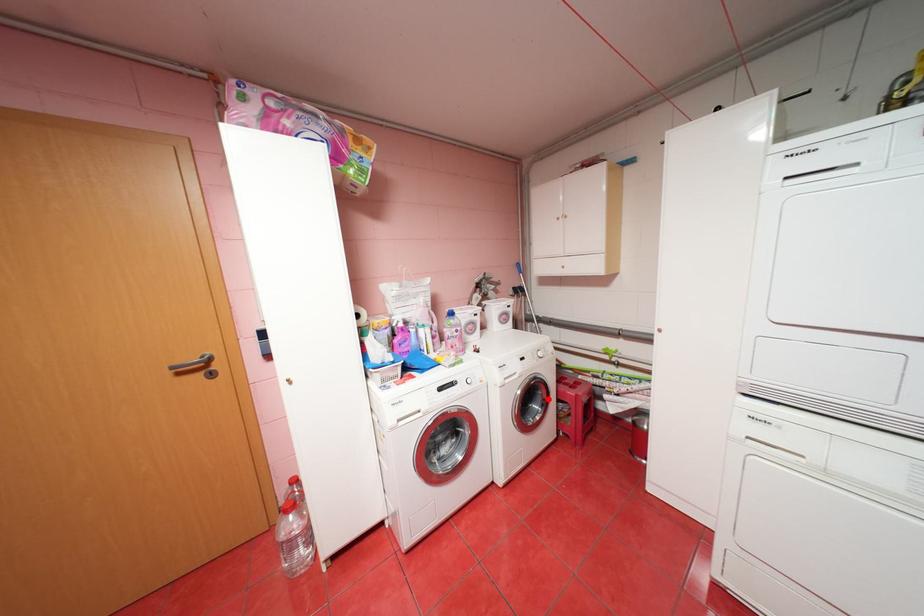
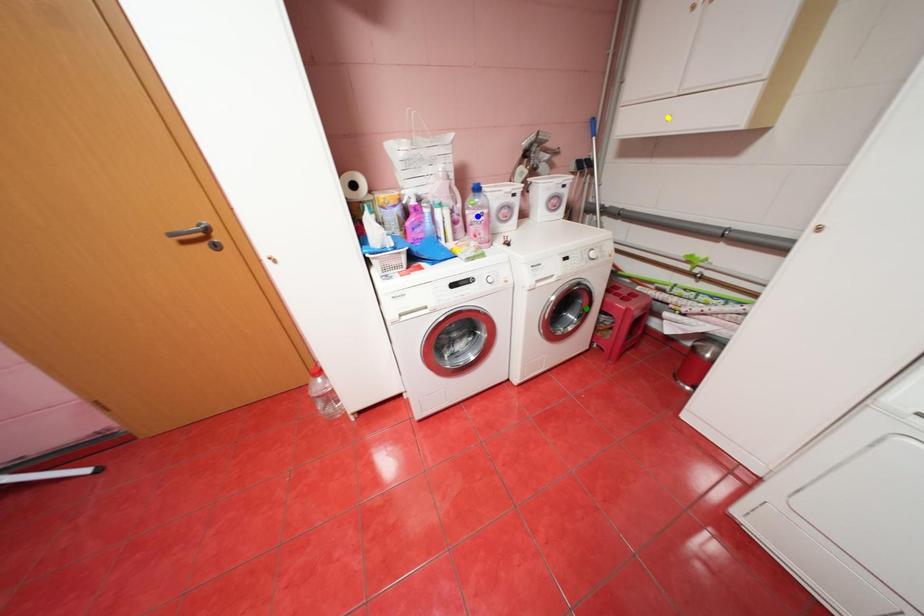
Question: I am providing you with two images of the same scene from different viewpoints. A red point is marked on the first image. You are given multiple points on the second image. Which mark in image 2 goes with the point in image 1?

Choices:
 (A) green point
 (B) blue point
 (C) yellow point

Answer: (A)